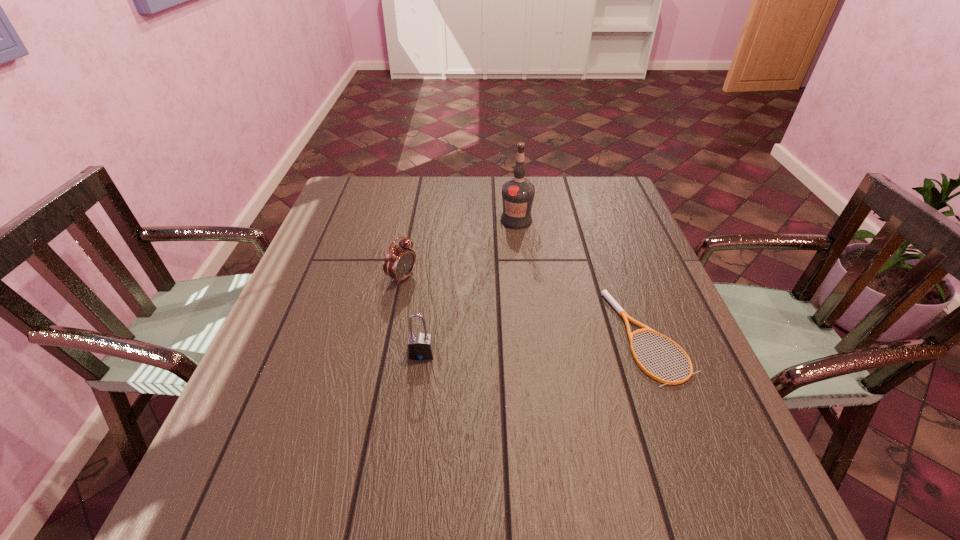
Where is `free spot on the desktop that is between the padlock and the shortest object and is positioned on the front label of the vodka`? The height and width of the screenshot is (540, 960). free spot on the desktop that is between the padlock and the shortest object and is positioned on the front label of the vodka is located at coordinates (560, 343).

Identify the location of vacant space on the desktop that is between the third object from right to left and the shortest object and is positioned on the face of the second farthest object. (538, 345).